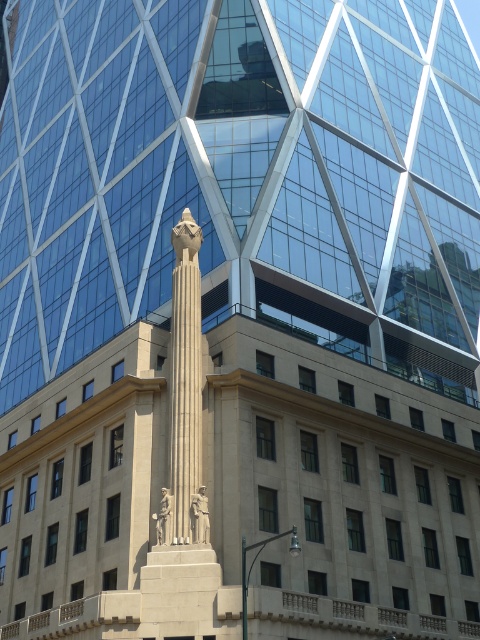
From the picture: Does stone statue at center appear over polished bronze statue at center?

Indeed, stone statue at center is positioned over polished bronze statue at center.

Can you confirm if stone statue at center is positioned below polished bronze statue at center?

Actually, stone statue at center is above polished bronze statue at center.

Between point (197, 502) and point (158, 528), which one is positioned in front?

Positioned in front is point (158, 528).

Identify the location of stone statue at center. (200, 516).

The image size is (480, 640). Describe the element at coordinates (186, 380) in the screenshot. I see `white marble column at center` at that location.

Can you confirm if white marble column at center is smaller than stone statue at center?

No, white marble column at center is not smaller than stone statue at center.

Is point (171, 480) farther from viewer compared to point (202, 496)?

Yes, it is.

I want to click on white marble column at center, so click(x=186, y=380).

Between point (192, 314) and point (169, 541), which one is positioned behind?

Positioned behind is point (192, 314).

Based on the photo, is white marble column at center positioned before polished bronze statue at center?

Yes.

Between point (181, 253) and point (163, 531), which one is positioned in front?

Point (163, 531) is more forward.

Find the location of a particular element. The width and height of the screenshot is (480, 640). white marble column at center is located at coordinates coord(186,380).